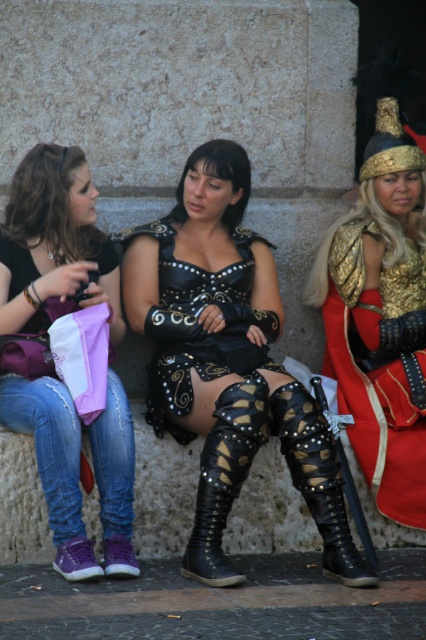
Question: Is denim jeans at lower left in front of gold metallic armor at right?

Choices:
 (A) yes
 (B) no

Answer: (A)

Question: Which object appears farthest from the camera in this image?

Choices:
 (A) denim jeans at lower left
 (B) leather/golden studded boot at center
 (C) gold metallic armor at right
 (D) leather/golden studs boot at center

Answer: (C)

Question: Is denim jeans at lower left above gold metallic armor at right?

Choices:
 (A) no
 (B) yes

Answer: (B)

Question: Which point appears farthest from the camera in this image?

Choices:
 (A) (409, 339)
 (B) (5, 401)

Answer: (A)

Question: In this image, where is gold metallic armor at right located relative to leather/golden studs boot at center?

Choices:
 (A) above
 (B) below

Answer: (A)

Question: Which point is closer to the camera?

Choices:
 (A) leather/golden studs boot at center
 (B) denim jeans at lower left

Answer: (A)